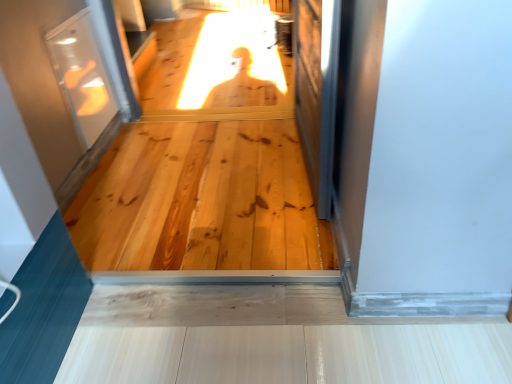
Question: From a real-world perspective, is transparent glass screen door at right, the first screen door from the right, on natural wood flooring at center?

Choices:
 (A) no
 (B) yes

Answer: (B)

Question: Is transparent glass screen door at right, the first screen door from the right, positioned with its back to natural wood flooring at center?

Choices:
 (A) no
 (B) yes

Answer: (A)

Question: Is transparent glass screen door at right, the second screen door viewed from the left, behind natural wood flooring at center?

Choices:
 (A) no
 (B) yes

Answer: (A)

Question: Is transparent glass screen door at right, the first screen door from the right, directly adjacent to natural wood flooring at center?

Choices:
 (A) yes
 (B) no

Answer: (B)

Question: Is transparent glass screen door at right, the first screen door from the right, outside natural wood flooring at center?

Choices:
 (A) yes
 (B) no

Answer: (A)

Question: Is transparent glass screen door at right, the second screen door viewed from the left, to the left of natural wood flooring at center from the viewer's perspective?

Choices:
 (A) no
 (B) yes

Answer: (A)

Question: Is natural wood flooring at center touching transparent glass screen door at right, the first screen door from the right?

Choices:
 (A) yes
 (B) no

Answer: (B)

Question: Is natural wood flooring at center far from transparent glass screen door at right, the first screen door from the right?

Choices:
 (A) yes
 (B) no

Answer: (B)

Question: From a real-world perspective, is natural wood flooring at center on top of transparent glass screen door at right, the first screen door from the right?

Choices:
 (A) yes
 (B) no

Answer: (B)

Question: Does natural wood flooring at center appear on the left side of transparent glass screen door at right, the first screen door from the right?

Choices:
 (A) yes
 (B) no

Answer: (A)

Question: Can you confirm if natural wood flooring at center is wider than transparent glass screen door at right, the first screen door from the right?

Choices:
 (A) yes
 (B) no

Answer: (A)

Question: Can you confirm if natural wood flooring at center is smaller than transparent glass screen door at right, the second screen door viewed from the left?

Choices:
 (A) no
 (B) yes

Answer: (A)

Question: Can we say transparent glass screen door at right, the first screen door from the right, lies outside clear glass screen door at upper left, the 1th screen door when ordered from left to right?

Choices:
 (A) yes
 (B) no

Answer: (A)